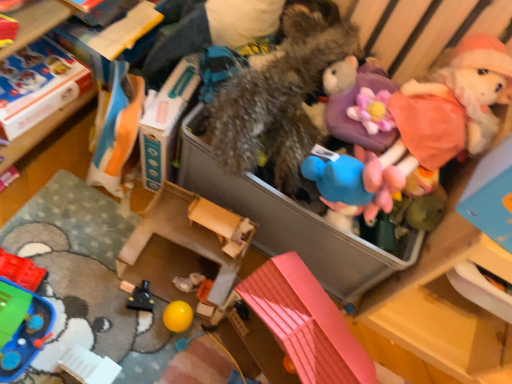
Question: Looking at their shapes, would you say orange fabric bag at upper left, the 3th toy viewed from the left, is wider or thinner than pink plastic toy house at lower center, which is the third toy from right to left?

Choices:
 (A) wide
 (B) thin

Answer: (B)

Question: In the image, is orange fabric bag at upper left, the 3th toy viewed from the left, on the left side or the right side of pink plastic toy house at lower center, the sixth toy positioned from the left?

Choices:
 (A) left
 (B) right

Answer: (A)

Question: Which of these objects is positioned closest to the black plastic toy at lower left, the fifth toy viewed from the right?

Choices:
 (A) green plastic boat at lower left, which is the 7th toy in right-to-left order
 (B) cardboard box at upper left, which is counted as the third storage box, starting from the right
 (C) wooden dollhouse at center, which is the 2th storage box in left-to-right order
 (D) fluffy plush doll at upper right, the eighth toy in the left-to-right sequence
 (E) pink plastic toy house at lower center, which is the third toy from right to left

Answer: (C)

Question: Based on their relative distances, which object is nearer to the cardboard box at upper left, which is counted as the third storage box, starting from the right?

Choices:
 (A) green plastic boat at lower left, which is the 7th toy in right-to-left order
 (B) purple fabric flower at upper center, arranged as the second clothing when viewed from the left
 (C) fuzzy fabric stuffed animal at center, positioned as the 4th toy in right-to-left order
 (D) black plastic toy at lower left, acting as the fourth toy starting from the left
 (E) translucent plastic bricks at lower left, which is counted as the first toy, starting from the left

Answer: (E)